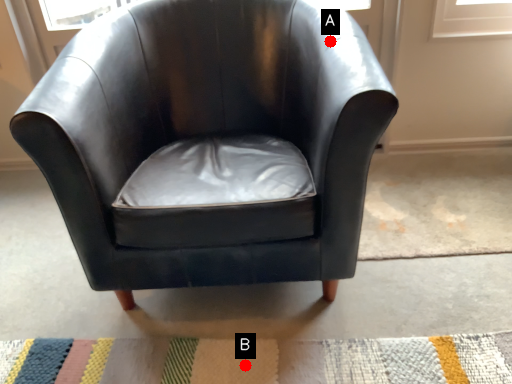
Question: Two points are circled on the image, labeled by A and B beside each circle. Which of the following is the farthest from the observer?

Choices:
 (A) A is further
 (B) B is further

Answer: (A)